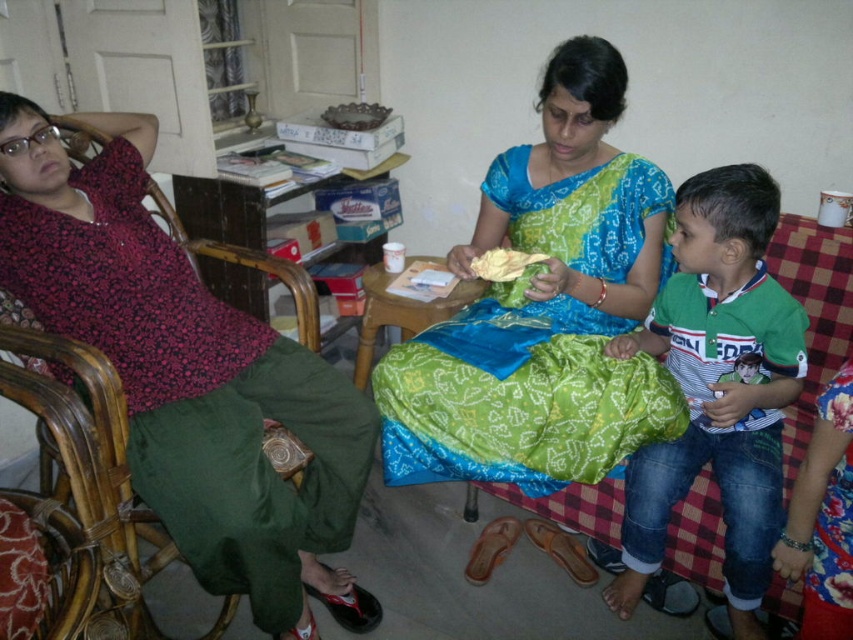
Looking at this image, can you confirm if matte green pants at left is positioned below yellow fabric cloth at center?

Yes.

Does matte green pants at left lie behind yellow fabric cloth at center?

No, it is not.

Does point (73, 316) come closer to viewer compared to point (490, 273)?

Yes, it is.

The image size is (853, 640). Identify the location of matte green pants at left. (189, 376).

Can you confirm if matte green pants at left is smaller than wooden table at center?

Incorrect, matte green pants at left is not smaller in size than wooden table at center.

Is point (329, 506) positioned in front of point (421, 314)?

That is True.

Is point (25, 236) farther from viewer compared to point (380, 289)?

No.

Where is `matte green pants at left`? matte green pants at left is located at coordinates (189, 376).

Does matte green pants at left lie behind green striped shirt at right?

No, it is not.

Can you confirm if matte green pants at left is smaller than green striped shirt at right?

Incorrect, matte green pants at left is not smaller in size than green striped shirt at right.

Locate an element on the screen. The width and height of the screenshot is (853, 640). matte green pants at left is located at coordinates (189, 376).

Locate an element on the screen. The width and height of the screenshot is (853, 640). matte green pants at left is located at coordinates (189, 376).